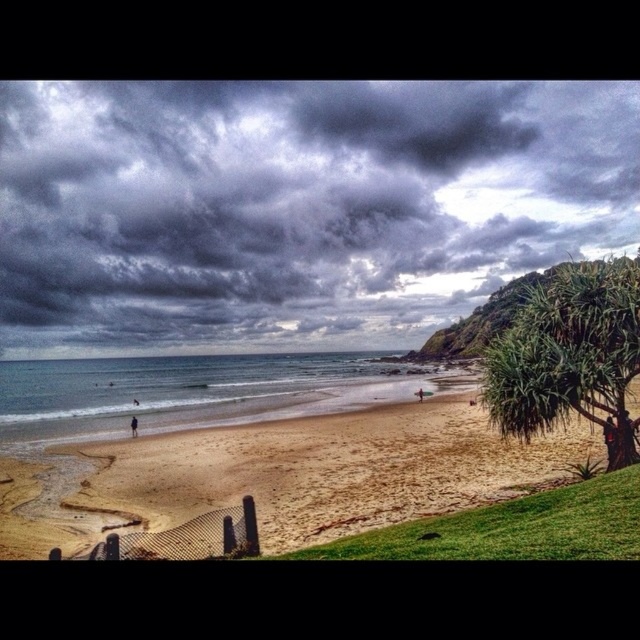
Does green leafy tree at right have a greater width compared to dark blue fabric at lower left?

Indeed, green leafy tree at right has a greater width compared to dark blue fabric at lower left.

Between point (634, 337) and point (132, 422), which one is positioned in front?

Positioned in front is point (634, 337).

Where is `green leafy tree at right`? green leafy tree at right is located at coordinates (570, 355).

Between sandy beach at lower left and pink fabric surfboard at center, which one is positioned higher?

pink fabric surfboard at center

Is point (452, 380) closer to camera compared to point (416, 394)?

No.

Who is more forward, (275, 540) or (417, 400)?

Point (275, 540)

You are a GUI agent. You are given a task and a screenshot of the screen. Output one action in this format:
    pyautogui.click(x=<x>, y=<y>)
    Task: Click on the sandy beach at lower left
    Image resolution: width=640 pixels, height=640 pixels.
    Given the screenshot: What is the action you would take?
    pyautogui.click(x=275, y=440)

Between sandy beach at lower left and blue water at beach center, which one appears on the left side from the viewer's perspective?

Positioned to the left is blue water at beach center.

Does sandy beach at lower left appear on the right side of blue water at beach center?

Yes, sandy beach at lower left is to the right of blue water at beach center.

Locate an element on the screen. This screenshot has width=640, height=640. sandy beach at lower left is located at coordinates (275, 440).

You are a GUI agent. You are given a task and a screenshot of the screen. Output one action in this format:
    pyautogui.click(x=<x>, y=<y>)
    Task: Click on the sandy beach at lower left
    
    Given the screenshot: What is the action you would take?
    pyautogui.click(x=275, y=440)